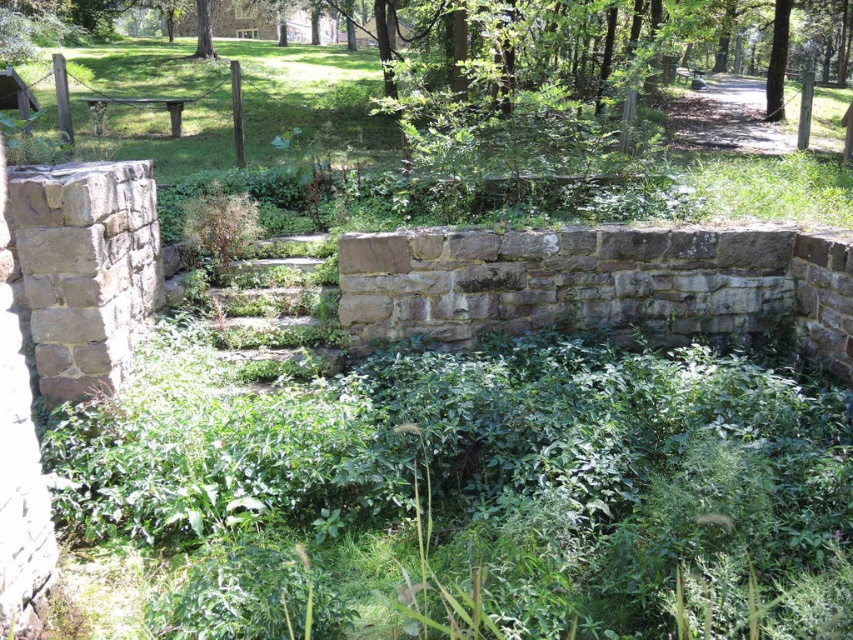
Question: Is green leafy tree at upper right wider than green leafy tree at upper center?

Choices:
 (A) no
 (B) yes

Answer: (B)

Question: Which object is positioned farthest from the wooden park bench at center?

Choices:
 (A) green leafy tree at upper right
 (B) green leafy tree at upper center

Answer: (A)

Question: Can you confirm if green leafy tree at upper right is thinner than wooden park bench at center?

Choices:
 (A) no
 (B) yes

Answer: (A)

Question: Among these points, which one is farthest from the camera?

Choices:
 (A) (784, 36)
 (B) (93, 131)

Answer: (A)

Question: Which of these objects is positioned closest to the green leafy tree at upper right?

Choices:
 (A) wooden park bench at center
 (B) green leafy tree at upper center

Answer: (A)

Question: Is green leafy tree at upper right thinner than green leafy tree at upper center?

Choices:
 (A) no
 (B) yes

Answer: (A)